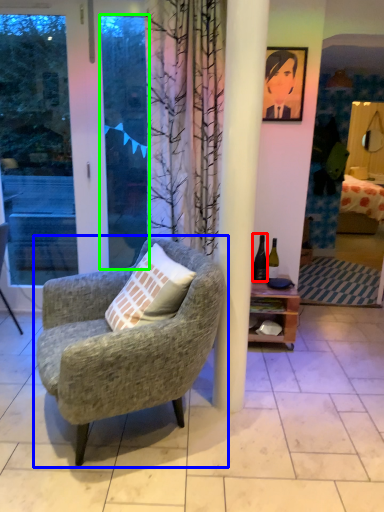
Question: Considering the real-world distances, which object is farthest from bottle (highlighted by a red box)? chair (highlighted by a blue box) or window screen (highlighted by a green box)?

Choices:
 (A) chair
 (B) window screen

Answer: (A)